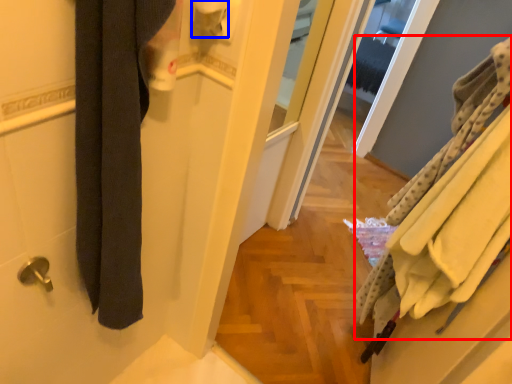
Question: Among these objects, which one is farthest to the camera, bath towel (highlighted by a red box) or toilet paper (highlighted by a blue box)?

Choices:
 (A) bath towel
 (B) toilet paper

Answer: (A)